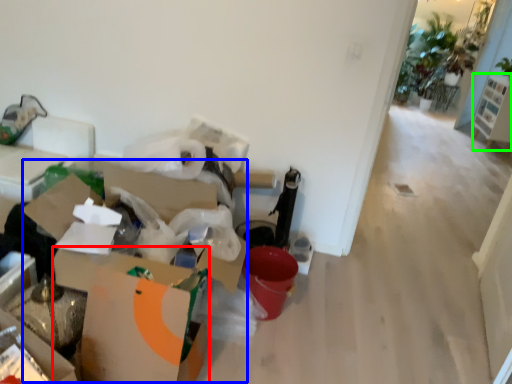
Question: Considering the real-world distances, which object is farthest from cardboard box (highlighted by a red box)? cardboard box (highlighted by a blue box) or furniture (highlighted by a green box)?

Choices:
 (A) cardboard box
 (B) furniture

Answer: (B)